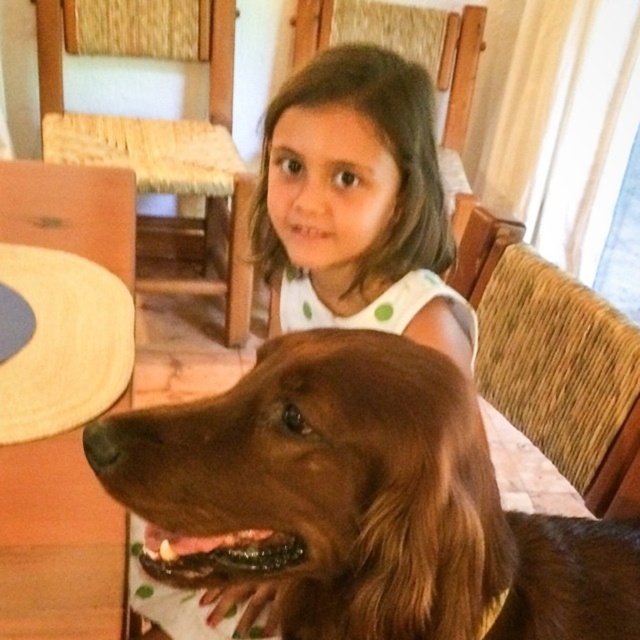
Question: Is brown furry dog at center above woven wood chair at upper left?

Choices:
 (A) yes
 (B) no

Answer: (B)

Question: Among these objects, which one is farthest from the camera?

Choices:
 (A) woven wood chair at right
 (B) woven wood chair at upper left

Answer: (B)

Question: Based on their relative distances, which object is farther from the woven wood chair at upper left?

Choices:
 (A) woven wood chair at right
 (B) smooth brown hair at center

Answer: (A)

Question: Is brown furry dog at center above woven wood chair at right?

Choices:
 (A) yes
 (B) no

Answer: (B)

Question: Which point is farther from the camera taking this photo?

Choices:
 (A) (273, 252)
 (B) (156, 56)
 (C) (598, 566)
 (D) (628, 376)

Answer: (B)

Question: From the image, what is the correct spatial relationship of smooth brown hair at center in relation to woven wood chair at right?

Choices:
 (A) above
 (B) below

Answer: (A)